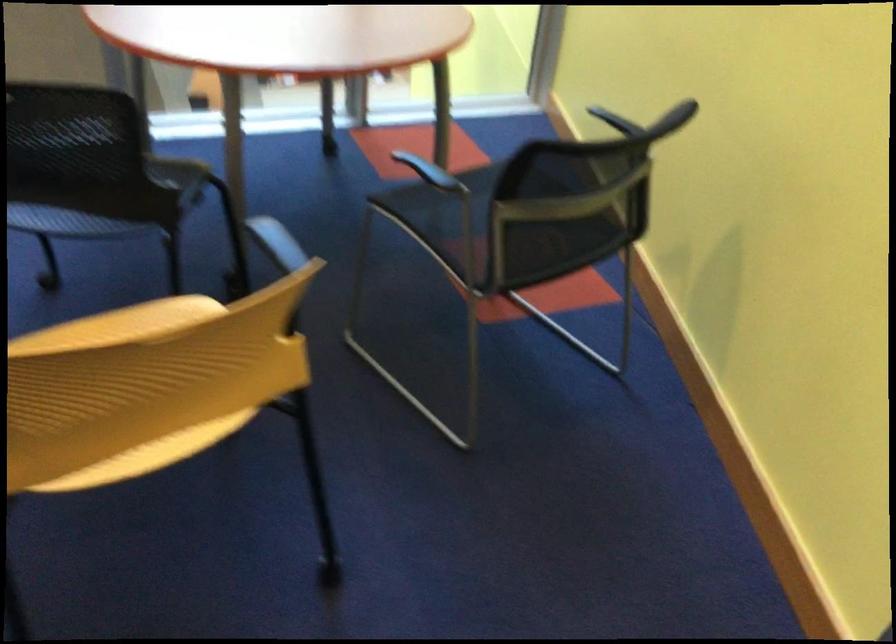
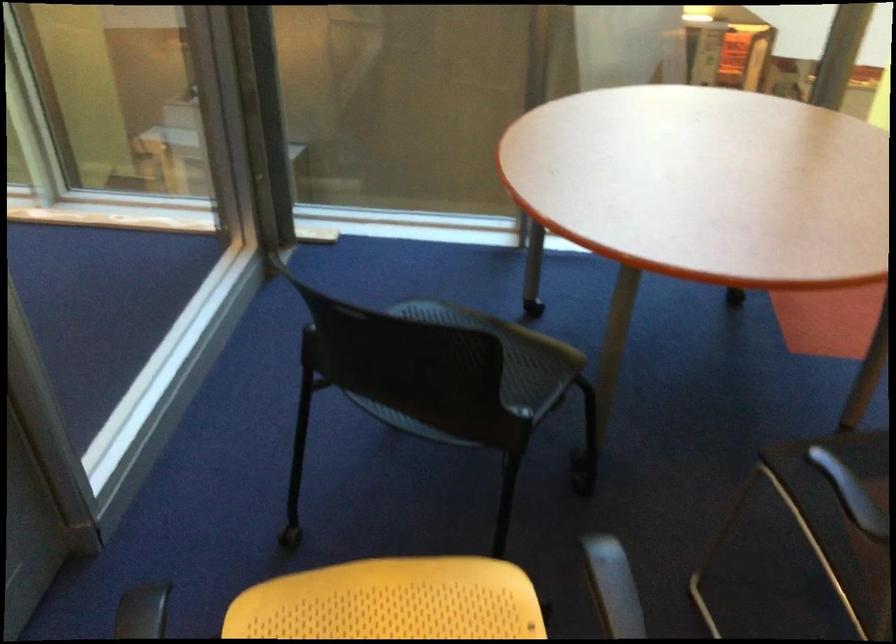
Question: Based on the continuous images, in which direction is the camera rotating? Reply with the corresponding letter.

Choices:
 (A) Left
 (B) Right
 (C) Up
 (D) Down

Answer: (A)